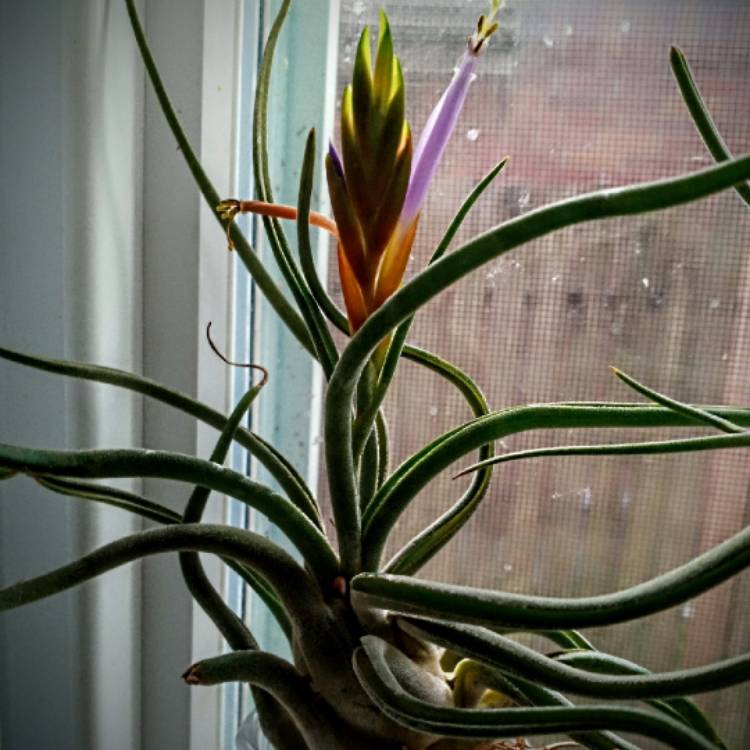
Identify the location of window. (560, 111).